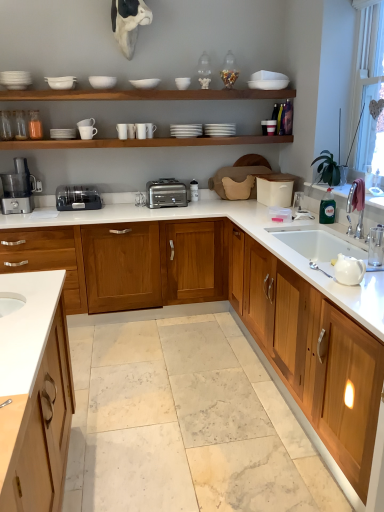
Question: Should I look upward or downward to see white marble countertop at center, placed as the second countertop when sorted from top to bottom?

Choices:
 (A) down
 (B) up

Answer: (A)

Question: Considering the relative sizes of satin black toaster at center, which is the second appliance from right to left, and satin silver toaster at center in the image provided, is satin black toaster at center, which is the second appliance from right to left, wider than satin silver toaster at center?

Choices:
 (A) no
 (B) yes

Answer: (A)

Question: Is satin black toaster at center, placed as the first appliance when sorted from front to back, not inside satin silver toaster at center?

Choices:
 (A) yes
 (B) no

Answer: (A)

Question: From the image's perspective, would you say satin black toaster at center, the 2th appliance from the back, is positioned over satin silver toaster at center?

Choices:
 (A) yes
 (B) no

Answer: (B)

Question: Considering the relative positions of satin black toaster at center, which is the second appliance from right to left, and satin silver toaster at center in the image provided, is satin black toaster at center, which is the second appliance from right to left, to the left of satin silver toaster at center from the viewer's perspective?

Choices:
 (A) no
 (B) yes

Answer: (B)

Question: Is satin black toaster at center, the first appliance positioned from the left, at the right side of satin silver toaster at center?

Choices:
 (A) yes
 (B) no

Answer: (B)

Question: Considering the relative sizes of satin black toaster at center, which is the second appliance from right to left, and satin silver toaster at center in the image provided, is satin black toaster at center, which is the second appliance from right to left, bigger than satin silver toaster at center?

Choices:
 (A) no
 (B) yes

Answer: (A)

Question: Is white glossy countertop at center, the second countertop from the bottom, closer to camera compared to white matte shelf at upper center?

Choices:
 (A) yes
 (B) no

Answer: (A)

Question: Does white glossy countertop at center, the 1th countertop from the top, have a greater height compared to white matte shelf at upper center?

Choices:
 (A) no
 (B) yes

Answer: (B)

Question: Is white glossy countertop at center, the 1th countertop from the top, shorter than white matte shelf at upper center?

Choices:
 (A) no
 (B) yes

Answer: (A)

Question: From the image's perspective, is white glossy countertop at center, the second countertop from the bottom, located above white matte shelf at upper center?

Choices:
 (A) no
 (B) yes

Answer: (A)

Question: Is white glossy countertop at center, the second countertop from the bottom, aimed at white matte shelf at upper center?

Choices:
 (A) yes
 (B) no

Answer: (B)

Question: Is white glossy countertop at center, the 1th countertop from the top, far away from white matte shelf at upper center?

Choices:
 (A) no
 (B) yes

Answer: (B)

Question: From the image's perspective, is transparent plastic window screen at upper right over satin silver toaster at center, which ranks as the 1th appliance in back-to-front order?

Choices:
 (A) yes
 (B) no

Answer: (A)